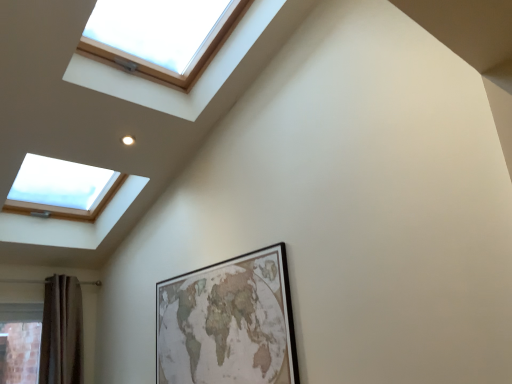
Question: Visually, is brown textured curtain at lower left positioned to the left or to the right of wooden framed map at center?

Choices:
 (A) right
 (B) left

Answer: (B)

Question: From a real-world perspective, is brown textured curtain at lower left physically located above or below wooden framed map at center?

Choices:
 (A) above
 (B) below

Answer: (A)

Question: Considering the real-world distances, which object is closest to the wooden frame skylight at upper left?

Choices:
 (A) wooden framed map at center
 (B) brown textured curtain at lower left

Answer: (A)

Question: Which object is positioned farthest from the wooden framed map at center?

Choices:
 (A) brown textured curtain at lower left
 (B) wooden frame skylight at upper left

Answer: (A)